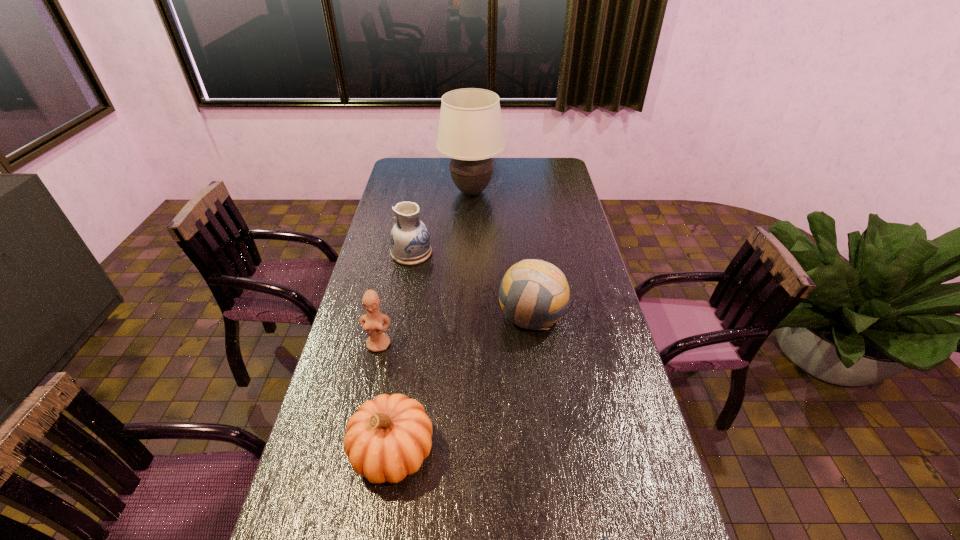
You are a GUI agent. You are given a task and a screenshot of the screen. Output one action in this format:
    pyautogui.click(x=<x>, y=<y>)
    Task: Click on the lampshade
    
    Given the screenshot: What is the action you would take?
    pyautogui.click(x=470, y=132)

Locate an element on the screen. the tallest object is located at coordinates (470, 132).

At what (x,y) coordinates should I click in order to perform the action: click on the second farthest object. Please return your answer as a coordinate pair (x, y). The image size is (960, 540). Looking at the image, I should click on (410, 241).

The image size is (960, 540). Find the location of `volleyball`. volleyball is located at coordinates (534, 294).

Where is `figurine`? figurine is located at coordinates (372, 322).

Find the location of `the fifth farthest object`. the fifth farthest object is located at coordinates (388, 438).

Locate an element on the screen. The height and width of the screenshot is (540, 960). free spot located 0.060m on the right of the lampshade is located at coordinates (516, 192).

The width and height of the screenshot is (960, 540). I want to click on free space located on the back of the fifth nearest object, so click(x=418, y=219).

At what (x,y) coordinates should I click in order to perform the action: click on free region located on the front of the volleyball. Please return your answer as a coordinate pair (x, y). The height and width of the screenshot is (540, 960). Looking at the image, I should click on (546, 430).

Locate an element on the screen. The width and height of the screenshot is (960, 540). vacant position located 0.340m on the front-facing side of the figurine is located at coordinates (353, 459).